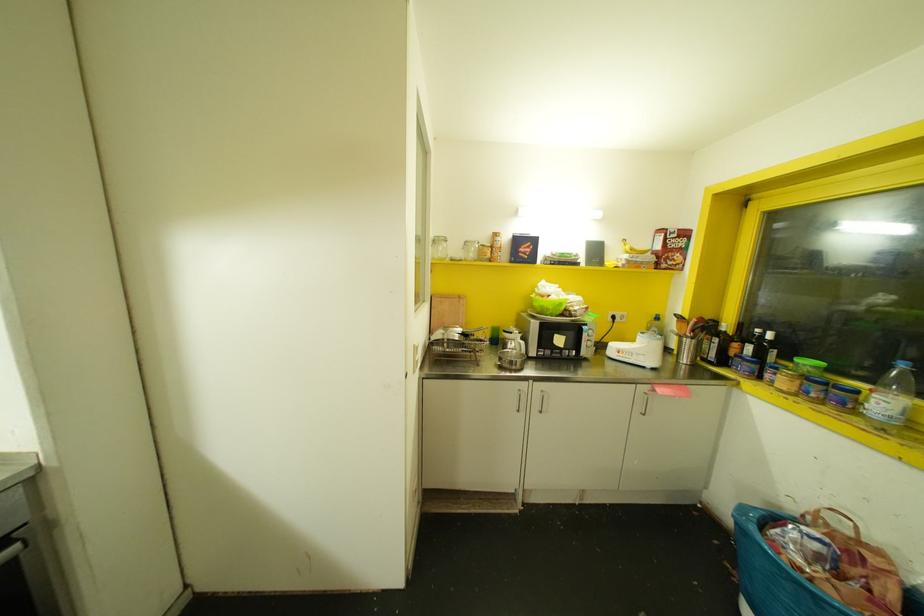
The width and height of the screenshot is (924, 616). What are the coordinates of `blender control dial` in the screenshot? It's located at (756, 344).